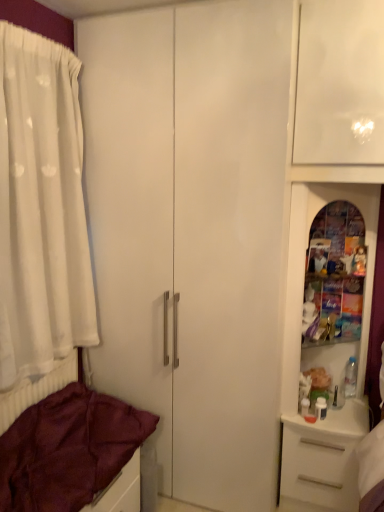
Question: Would you say maroon fabric bed at lower left is outside white sheer curtain at left?

Choices:
 (A) no
 (B) yes

Answer: (B)

Question: Does maroon fabric bed at lower left touch white sheer curtain at left?

Choices:
 (A) no
 (B) yes

Answer: (A)

Question: Is maroon fabric bed at lower left positioned far away from white sheer curtain at left?

Choices:
 (A) no
 (B) yes

Answer: (A)

Question: Considering the relative sizes of maroon fabric bed at lower left and white sheer curtain at left in the image provided, is maroon fabric bed at lower left wider than white sheer curtain at left?

Choices:
 (A) yes
 (B) no

Answer: (A)

Question: From a real-world perspective, does maroon fabric bed at lower left stand above white sheer curtain at left?

Choices:
 (A) yes
 (B) no

Answer: (B)

Question: In terms of height, does maroon fabric bed at lower left look taller or shorter compared to white plastic drawer at lower right?

Choices:
 (A) short
 (B) tall

Answer: (A)

Question: Is maroon fabric bed at lower left to the left or to the right of white plastic drawer at lower right in the image?

Choices:
 (A) left
 (B) right

Answer: (A)

Question: Is maroon fabric bed at lower left wider or thinner than white plastic drawer at lower right?

Choices:
 (A) thin
 (B) wide

Answer: (B)

Question: Looking at the image, does maroon fabric bed at lower left seem bigger or smaller compared to white plastic drawer at lower right?

Choices:
 (A) big
 (B) small

Answer: (B)

Question: Considering their positions, is white sheer curtain at left located in front of or behind maroon fabric bed at lower left?

Choices:
 (A) front
 (B) behind

Answer: (B)

Question: Is white sheer curtain at left situated inside maroon fabric bed at lower left or outside?

Choices:
 (A) outside
 (B) inside

Answer: (A)

Question: From the image's perspective, is white sheer curtain at left above or below maroon fabric bed at lower left?

Choices:
 (A) above
 (B) below

Answer: (A)

Question: In the image, is white sheer curtain at left on the left side or the right side of maroon fabric bed at lower left?

Choices:
 (A) right
 (B) left

Answer: (B)

Question: Considering the relative positions of white plastic drawer at lower right and white sheer curtain at left in the image provided, is white plastic drawer at lower right to the left or to the right of white sheer curtain at left?

Choices:
 (A) left
 (B) right

Answer: (B)

Question: Considering the positions of point (342, 449) and point (31, 374), is point (342, 449) closer or farther from the camera than point (31, 374)?

Choices:
 (A) farther
 (B) closer

Answer: (A)